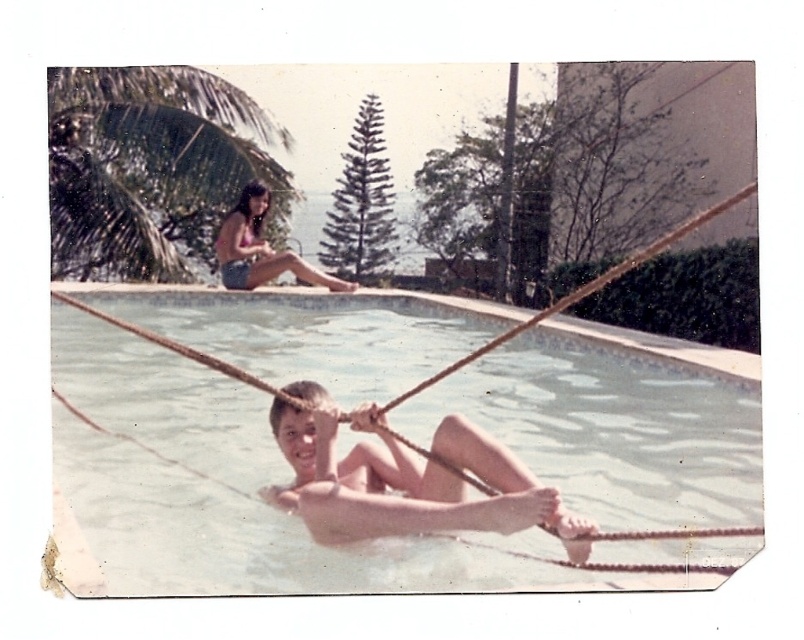
Question: Does green leafy palm tree at upper left have a greater width compared to smooth skin child at center?

Choices:
 (A) yes
 (B) no

Answer: (A)

Question: Which point is farther to the camera?

Choices:
 (A) [x=85, y=124]
 (B) [x=749, y=518]

Answer: (A)

Question: Does clear plastic water at center come behind matte pink bikini top at upper left?

Choices:
 (A) yes
 (B) no

Answer: (B)

Question: Which of the following is the farthest from the observer?

Choices:
 (A) green leafy palm tree at upper left
 (B) matte pink bikini top at upper left
 (C) smooth skin child at center

Answer: (B)

Question: Can you confirm if green leafy palm tree at upper left is bigger than smooth skin child at center?

Choices:
 (A) no
 (B) yes

Answer: (B)

Question: Which object is farther from the camera taking this photo?

Choices:
 (A) smooth skin child at center
 (B) matte pink bikini top at upper left
 (C) clear plastic water at center

Answer: (B)